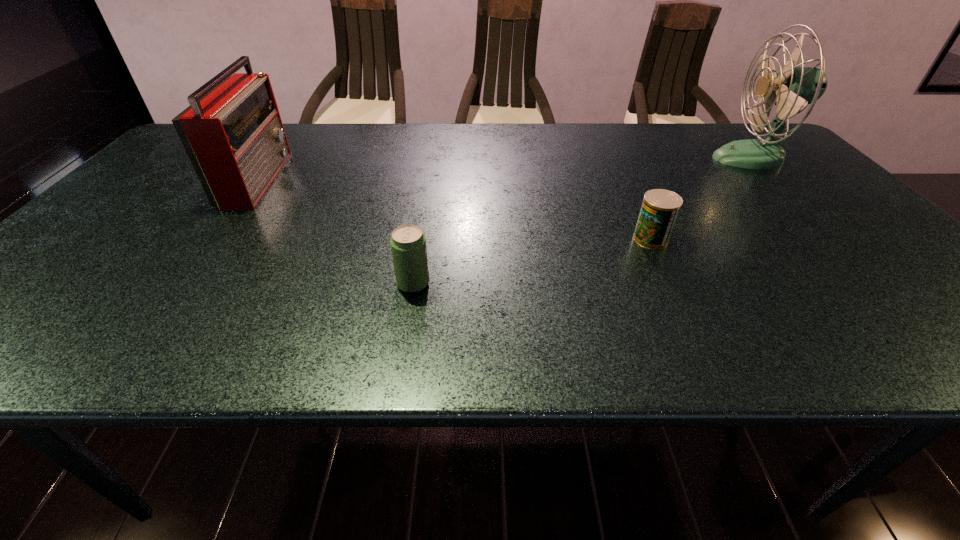
In order to click on blank space located 0.330m in front of the rightmost object, directing airflow in this screenshot , I will do `click(602, 158)`.

What are the coordinates of `vacant space located on the front-facing side of the radio receiver` in the screenshot? It's located at (396, 178).

You are a GUI agent. You are given a task and a screenshot of the screen. Output one action in this format:
    pyautogui.click(x=<x>, y=<y>)
    Task: Click on the free space located 0.270m on the back of the nearest object
    The width and height of the screenshot is (960, 540).
    Given the screenshot: What is the action you would take?
    pyautogui.click(x=427, y=202)

Find the location of `vacant space situated 0.200m on the back of the second object from right to left`. vacant space situated 0.200m on the back of the second object from right to left is located at coordinates (625, 185).

Find the location of `fan situated at the far edge`. fan situated at the far edge is located at coordinates (793, 88).

I want to click on radio receiver present at the far edge, so click(232, 132).

I want to click on object at the right edge, so click(x=793, y=88).

This screenshot has height=540, width=960. Find the location of `object at the far right corner`. object at the far right corner is located at coordinates (793, 88).

Find the location of a particular element. The width and height of the screenshot is (960, 540). vacant position at the far edge of the desktop is located at coordinates pos(618,136).

In the image, there is a desktop. Identify the location of free space at the near edge. The image size is (960, 540). (400, 334).